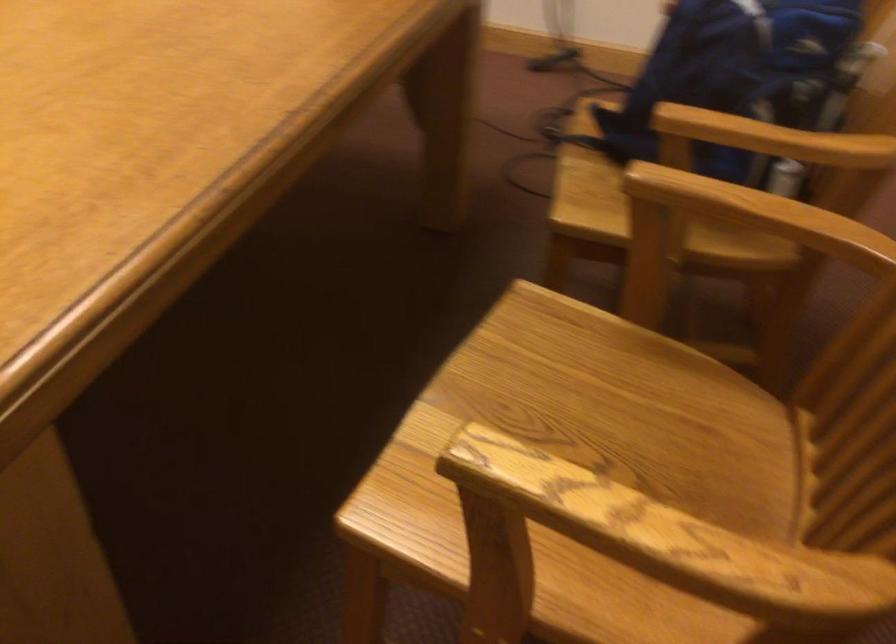
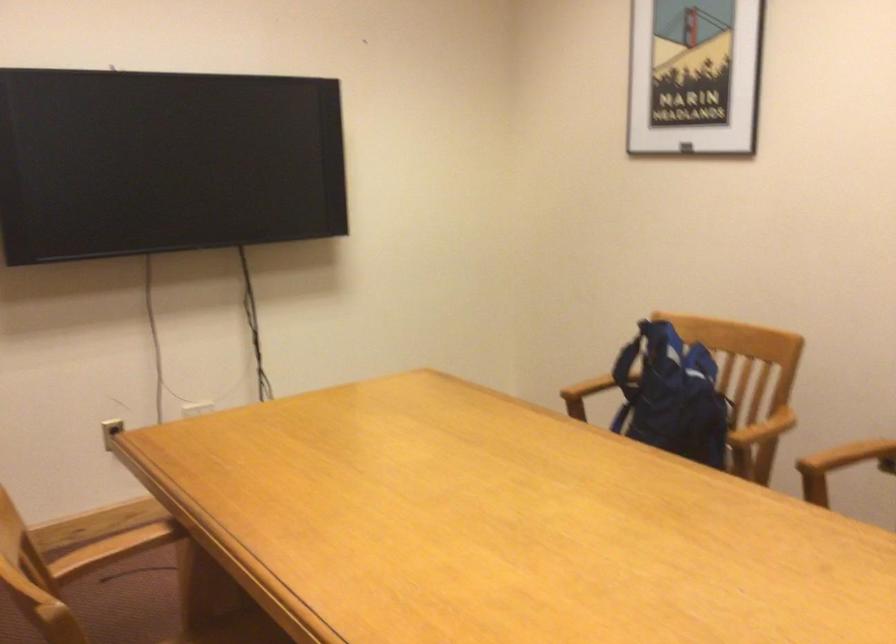
Question: I am providing you with two images of the same scene from different viewpoints. After the viewpoint changes to image2, which objects are now occluded?

Choices:
 (A) wooden chair armrest
 (B) silver keys
 (C) blue backpack
 (D) chair sitting surface

Answer: (D)